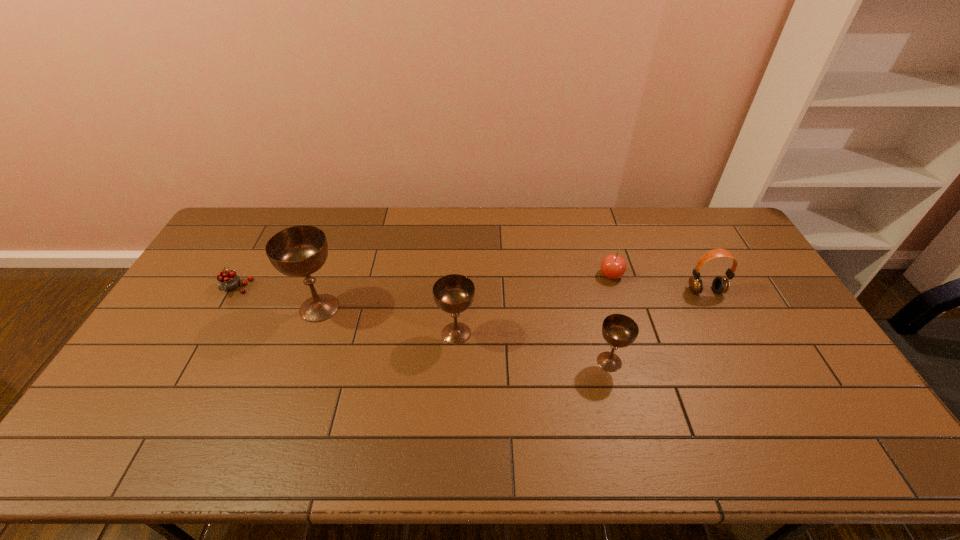
Where is `free space located 0.310m on the back of the rightmost chalice`? This screenshot has height=540, width=960. free space located 0.310m on the back of the rightmost chalice is located at coordinates (587, 274).

Where is `free location located 0.340m on the right of the apple`? The image size is (960, 540). free location located 0.340m on the right of the apple is located at coordinates pos(725,275).

The width and height of the screenshot is (960, 540). Identify the location of vacant space situated on the ear cups of the rightmost object. (726, 332).

Image resolution: width=960 pixels, height=540 pixels. I want to click on blank space located 0.050m on the handle side of the leftmost object, so [223, 310].

At what (x,y) coordinates should I click in order to perform the action: click on object at the left edge. Please return your answer as a coordinate pair (x, y). Looking at the image, I should click on (228, 280).

Identify the location of vacant region at the far edge of the desktop. (611, 227).

The height and width of the screenshot is (540, 960). I want to click on vacant space at the near edge, so click(x=539, y=415).

Find the location of a particular element. The image size is (960, 540). vacant space at the left edge is located at coordinates (158, 355).

Identify the location of free space at the right edge of the desktop. click(x=755, y=344).

Locate an element on the screen. free space at the far left corner of the desktop is located at coordinates (230, 235).